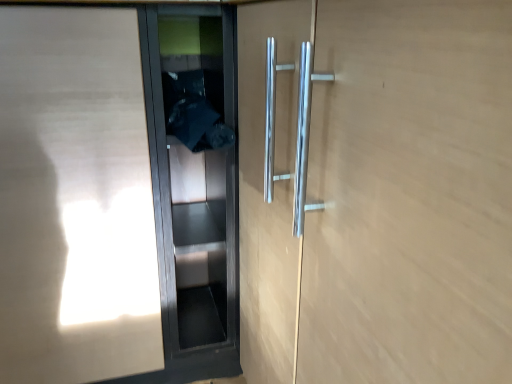
In the scene shown: What is the approximate width of matte wood elevator door at left, acting as the first elevator door starting from the left?

25.65 inches.

Locate an element on the screen. matte wood elevator door at left, acting as the first elevator door starting from the left is located at coordinates (75, 199).

Describe the element at coordinates (75, 199) in the screenshot. The width and height of the screenshot is (512, 384). I see `matte wood elevator door at left, arranged as the second elevator door when viewed from the right` at that location.

Where is `black glass elevator door at center, the first elevator door in the right-to-left sequence`? The height and width of the screenshot is (384, 512). black glass elevator door at center, the first elevator door in the right-to-left sequence is located at coordinates (194, 185).

The width and height of the screenshot is (512, 384). What do you see at coordinates (194, 185) in the screenshot? I see `black glass elevator door at center, the second elevator door in the left-to-right sequence` at bounding box center [194, 185].

Find the location of a particular element. This screenshot has height=384, width=512. matte wood elevator door at left, arranged as the second elevator door when viewed from the right is located at coordinates (75, 199).

Consider the image. Which object is positioned more to the left, black glass elevator door at center, the first elevator door in the right-to-left sequence, or matte wood elevator door at left, arranged as the second elevator door when viewed from the right?

Positioned to the left is matte wood elevator door at left, arranged as the second elevator door when viewed from the right.

Relative to matte wood elevator door at left, acting as the first elevator door starting from the left, is black glass elevator door at center, the second elevator door in the left-to-right sequence, in front or behind?

In the image, black glass elevator door at center, the second elevator door in the left-to-right sequence, appears behind matte wood elevator door at left, acting as the first elevator door starting from the left.

Which is in front, point (170, 71) or point (25, 366)?

The point (25, 366) is in front.

From the image's perspective, would you say black glass elevator door at center, the second elevator door in the left-to-right sequence, is shown under matte wood elevator door at left, arranged as the second elevator door when viewed from the right?

Yes.

From a real-world perspective, which object stands above the other?

matte wood elevator door at left, arranged as the second elevator door when viewed from the right, is physically above.

Is black glass elevator door at center, the second elevator door in the left-to-right sequence, thinner than matte wood elevator door at left, arranged as the second elevator door when viewed from the right?

Indeed, black glass elevator door at center, the second elevator door in the left-to-right sequence, has a lesser width compared to matte wood elevator door at left, arranged as the second elevator door when viewed from the right.

Is black glass elevator door at center, the second elevator door in the left-to-right sequence, taller than matte wood elevator door at left, acting as the first elevator door starting from the left?

No, black glass elevator door at center, the second elevator door in the left-to-right sequence, is not taller than matte wood elevator door at left, acting as the first elevator door starting from the left.

Considering the relative sizes of black glass elevator door at center, the second elevator door in the left-to-right sequence, and matte wood elevator door at left, acting as the first elevator door starting from the left, in the image provided, is black glass elevator door at center, the second elevator door in the left-to-right sequence, bigger than matte wood elevator door at left, acting as the first elevator door starting from the left,?

No, black glass elevator door at center, the second elevator door in the left-to-right sequence, is not bigger than matte wood elevator door at left, acting as the first elevator door starting from the left.

Is black glass elevator door at center, the second elevator door in the left-to-right sequence, not within matte wood elevator door at left, arranged as the second elevator door when viewed from the right?

Yes.

Are black glass elevator door at center, the second elevator door in the left-to-right sequence, and matte wood elevator door at left, arranged as the second elevator door when viewed from the right, far apart?

No, black glass elevator door at center, the second elevator door in the left-to-right sequence, is not far away from matte wood elevator door at left, arranged as the second elevator door when viewed from the right.

Is black glass elevator door at center, the second elevator door in the left-to-right sequence, oriented towards matte wood elevator door at left, acting as the first elevator door starting from the left?

No, black glass elevator door at center, the second elevator door in the left-to-right sequence, is not oriented towards matte wood elevator door at left, acting as the first elevator door starting from the left.

How different are the orientations of black glass elevator door at center, the second elevator door in the left-to-right sequence, and matte wood elevator door at left, arranged as the second elevator door when viewed from the right, in degrees?

The facing directions of black glass elevator door at center, the second elevator door in the left-to-right sequence, and matte wood elevator door at left, arranged as the second elevator door when viewed from the right, are 4.95e-05 degrees apart.

Where is `elevator door below the matte wood elevator door at left, acting as the first elevator door starting from the left (from the image's perspective)`? elevator door below the matte wood elevator door at left, acting as the first elevator door starting from the left (from the image's perspective) is located at coordinates (194, 185).

From the picture: Visually, is matte wood elevator door at left, arranged as the second elevator door when viewed from the right, positioned to the left or to the right of black glass elevator door at center, the second elevator door in the left-to-right sequence?

From the image, it's evident that matte wood elevator door at left, arranged as the second elevator door when viewed from the right, is to the left of black glass elevator door at center, the second elevator door in the left-to-right sequence.

Does matte wood elevator door at left, arranged as the second elevator door when viewed from the right, come in front of black glass elevator door at center, the second elevator door in the left-to-right sequence?

Yes, matte wood elevator door at left, arranged as the second elevator door when viewed from the right, is in front of black glass elevator door at center, the second elevator door in the left-to-right sequence.

Which point is more distant from viewer, (119, 358) or (162, 97)?

The point (119, 358) is behind.

From the image's perspective, which is below, matte wood elevator door at left, acting as the first elevator door starting from the left, or black glass elevator door at center, the second elevator door in the left-to-right sequence?

black glass elevator door at center, the second elevator door in the left-to-right sequence, from the image's perspective.

Looking at this image, from a real-world perspective, is matte wood elevator door at left, arranged as the second elevator door when viewed from the right, positioned under black glass elevator door at center, the second elevator door in the left-to-right sequence, based on gravity?

No, from a real-world perspective, matte wood elevator door at left, arranged as the second elevator door when viewed from the right, is not under black glass elevator door at center, the second elevator door in the left-to-right sequence.

Which object is wider, matte wood elevator door at left, acting as the first elevator door starting from the left, or black glass elevator door at center, the second elevator door in the left-to-right sequence?

matte wood elevator door at left, acting as the first elevator door starting from the left.

Can you confirm if matte wood elevator door at left, acting as the first elevator door starting from the left, is taller than black glass elevator door at center, the first elevator door in the right-to-left sequence?

Indeed, matte wood elevator door at left, acting as the first elevator door starting from the left, has a greater height compared to black glass elevator door at center, the first elevator door in the right-to-left sequence.

Which of these two, matte wood elevator door at left, acting as the first elevator door starting from the left, or black glass elevator door at center, the second elevator door in the left-to-right sequence, is bigger?

With larger size is matte wood elevator door at left, acting as the first elevator door starting from the left.

Would you say matte wood elevator door at left, acting as the first elevator door starting from the left, is inside or outside black glass elevator door at center, the first elevator door in the right-to-left sequence?

matte wood elevator door at left, acting as the first elevator door starting from the left, is located beyond the bounds of black glass elevator door at center, the first elevator door in the right-to-left sequence.

Is matte wood elevator door at left, acting as the first elevator door starting from the left, not near black glass elevator door at center, the second elevator door in the left-to-right sequence?

They are positioned close to each other.

Could you tell me if matte wood elevator door at left, acting as the first elevator door starting from the left, is facing black glass elevator door at center, the first elevator door in the right-to-left sequence?

No, matte wood elevator door at left, acting as the first elevator door starting from the left, is not aimed at black glass elevator door at center, the first elevator door in the right-to-left sequence.

How different are the orientations of matte wood elevator door at left, acting as the first elevator door starting from the left, and black glass elevator door at center, the second elevator door in the left-to-right sequence, in degrees?

The angular difference between matte wood elevator door at left, acting as the first elevator door starting from the left, and black glass elevator door at center, the second elevator door in the left-to-right sequence, is 4.95e-05 degrees.

The image size is (512, 384). I want to click on elevator door below the matte wood elevator door at left, acting as the first elevator door starting from the left (from the image's perspective), so (194, 185).

Identify the location of elevator door above the black glass elevator door at center, the first elevator door in the right-to-left sequence (from a real-world perspective). Image resolution: width=512 pixels, height=384 pixels. (75, 199).

At what (x,y) coordinates should I click in order to perform the action: click on elevator door below the matte wood elevator door at left, acting as the first elevator door starting from the left (from a real-world perspective). Please return your answer as a coordinate pair (x, y). Looking at the image, I should click on (194, 185).